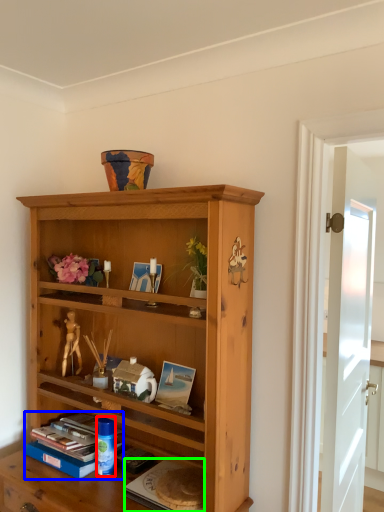
Question: Based on their relative distances, which object is farther from toy (highlighted by a red box)? Choose from book (highlighted by a blue box) and paperback book (highlighted by a green box).

Choices:
 (A) book
 (B) paperback book

Answer: (B)